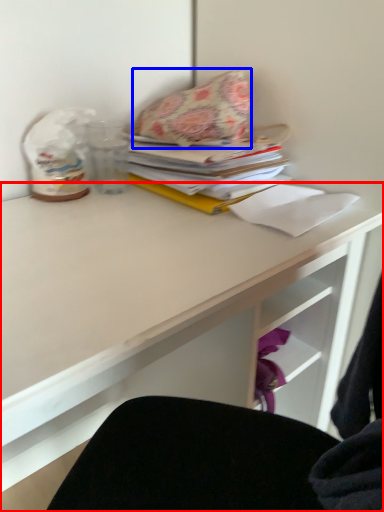
Question: Which point is further to the camera, desk (highlighted by a red box) or throw pillow (highlighted by a blue box)?

Choices:
 (A) desk
 (B) throw pillow

Answer: (B)